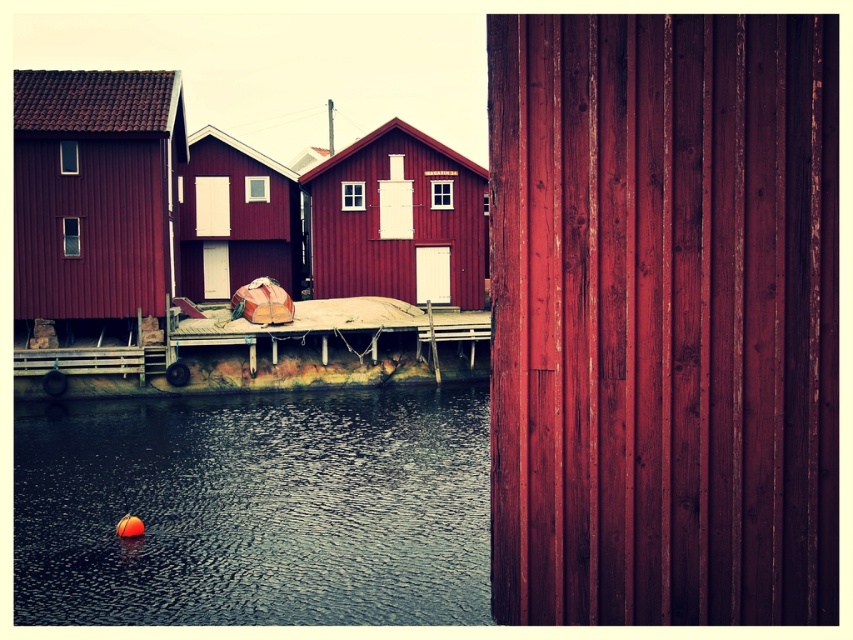
Question: Which point is farther to the camera?

Choices:
 (A) (258, 326)
 (B) (50, 246)

Answer: (A)

Question: Does matte wood hut at center appear under matte red wooden hut at center?

Choices:
 (A) no
 (B) yes

Answer: (B)

Question: Considering the real-world distances, which object is farthest from the matte wood hut at left?

Choices:
 (A) matte red wooden hut at center
 (B) matte wood hut at center
 (C) wooden dock at center
 (D) smooth dark water at lower left

Answer: (B)

Question: Based on their relative distances, which object is nearer to the matte wood hut at center?

Choices:
 (A) matte red wooden hut at center
 (B) smooth dark water at lower left
 (C) matte wood hut at left

Answer: (A)

Question: Does matte wood hut at left appear under matte wood hut at center?

Choices:
 (A) no
 (B) yes

Answer: (A)

Question: Can you confirm if matte wood hut at left is positioned to the right of wooden dock at center?

Choices:
 (A) no
 (B) yes

Answer: (A)